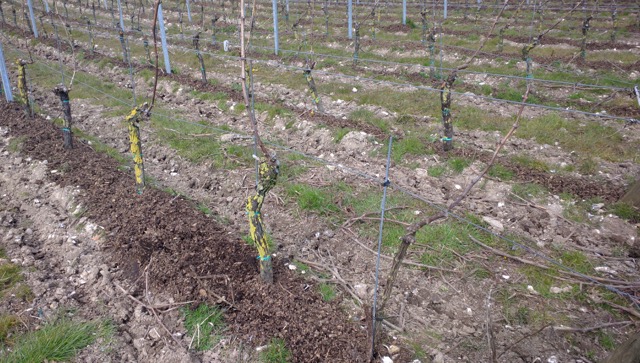
The image size is (640, 363). I want to click on wires, so click(x=402, y=61), click(x=348, y=171).